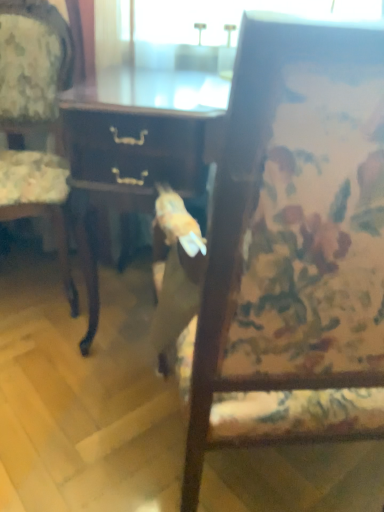
The width and height of the screenshot is (384, 512). I want to click on vacant region under wooden desk at center (from a real-world perspective), so click(x=132, y=315).